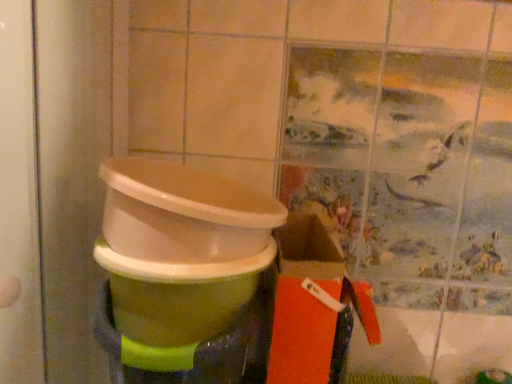
Question: In terms of width, does green glossy waste container at center look wider or thinner when compared to green glossy toilet bowl at center?

Choices:
 (A) thin
 (B) wide

Answer: (A)

Question: In terms of size, does green glossy waste container at center appear bigger or smaller than green glossy toilet bowl at center?

Choices:
 (A) big
 (B) small

Answer: (B)

Question: Estimate the real-world distances between objects in this image. Which object is farther from the green glossy waste container at center?

Choices:
 (A) green glossy toilet bowl at center
 (B) orange matte box at lower right

Answer: (B)

Question: Estimate the real-world distances between objects in this image. Which object is farther from the green glossy waste container at center?

Choices:
 (A) green glossy toilet bowl at center
 (B) orange matte box at lower right

Answer: (B)